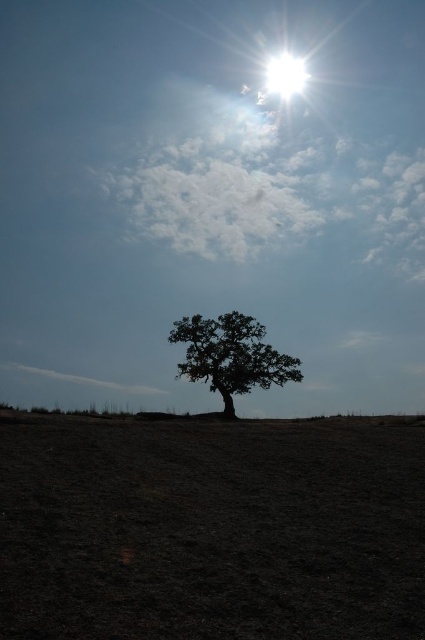
Question: Can you confirm if silhouette leafy tree at center is smaller than bright white sun at upper center?

Choices:
 (A) no
 (B) yes

Answer: (A)

Question: Does silhouette leafy tree at center appear over bright white sun at upper center?

Choices:
 (A) no
 (B) yes

Answer: (A)

Question: Which object appears farthest from the camera in this image?

Choices:
 (A) silhouette leafy tree at center
 (B) bright white sun at upper center

Answer: (B)

Question: Is silhouette leafy tree at center bigger than bright white sun at upper center?

Choices:
 (A) yes
 (B) no

Answer: (A)

Question: Which of the following is the closest to the observer?

Choices:
 (A) (283, 97)
 (B) (263, 344)

Answer: (B)

Question: Which point appears closest to the camera in this image?

Choices:
 (A) (198, 369)
 (B) (283, 56)

Answer: (A)